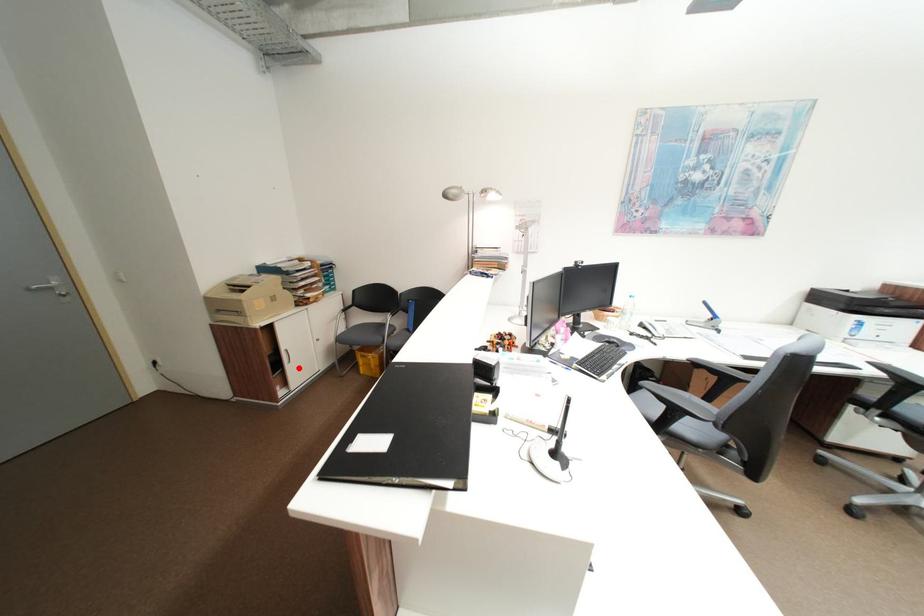
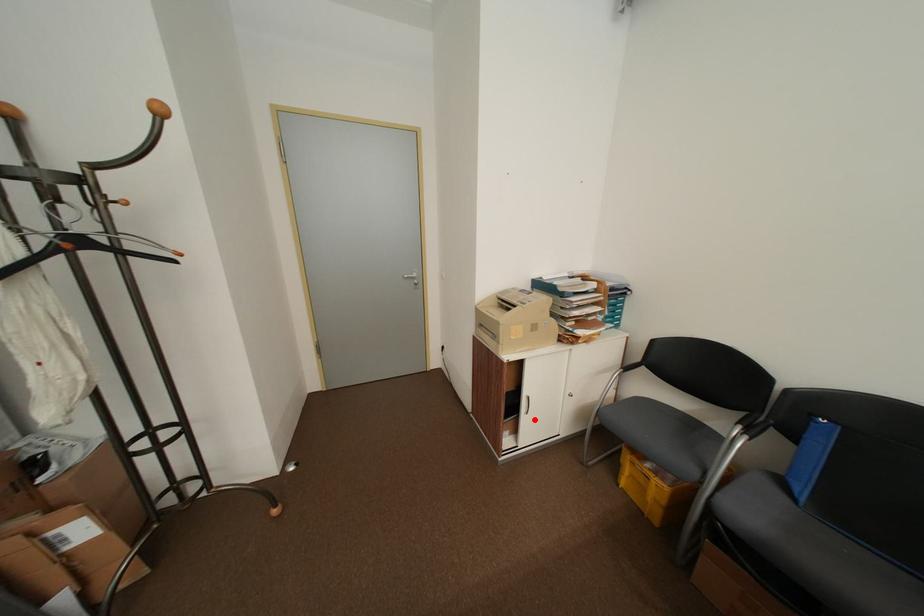
I am providing you with two images of the same scene from different viewpoints. A red point is marked on the first image and another point is marked on the second image. Does the point marked in image1 correspond to the same location as the one in image2?

Yes